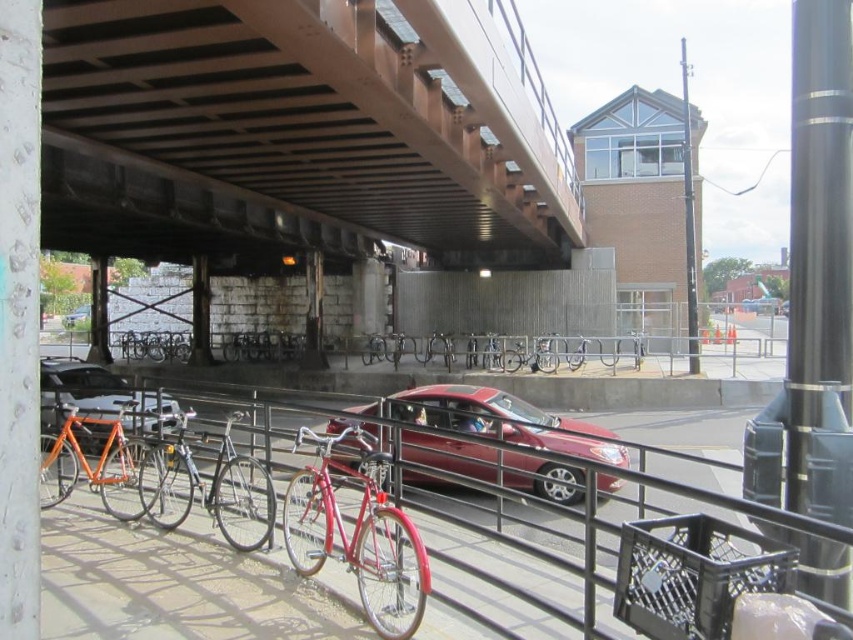
Between shiny red bicycle at center and smooth gray pole at upper right, which one is positioned lower?

shiny red bicycle at center is below.

Is shiny red bicycle at center closer to camera compared to smooth gray pole at upper right?

Yes.

What do you see at coordinates (357, 532) in the screenshot? I see `shiny red bicycle at center` at bounding box center [357, 532].

Identify the location of shiny red bicycle at center. This screenshot has width=853, height=640. (357, 532).

Is shiny metallic car at center thinner than smooth gray pole at upper right?

Indeed, shiny metallic car at center has a lesser width compared to smooth gray pole at upper right.

Is point (537, 445) less distant than point (689, 164)?

Yes, point (537, 445) is closer to viewer.

Which is in front, point (363, 412) or point (689, 316)?

Point (363, 412) is in front.

Locate an element on the screen. shiny metallic car at center is located at coordinates (506, 420).

Who is taller, shiny red bicycle at center or orange matte bicycle at left?

orange matte bicycle at left

Which of these two, shiny red bicycle at center or orange matte bicycle at left, stands shorter?

Standing shorter between the two is shiny red bicycle at center.

Locate an element on the screen. shiny red bicycle at center is located at coordinates (357, 532).

Find the location of `shiny red bicycle at center`. shiny red bicycle at center is located at coordinates (357, 532).